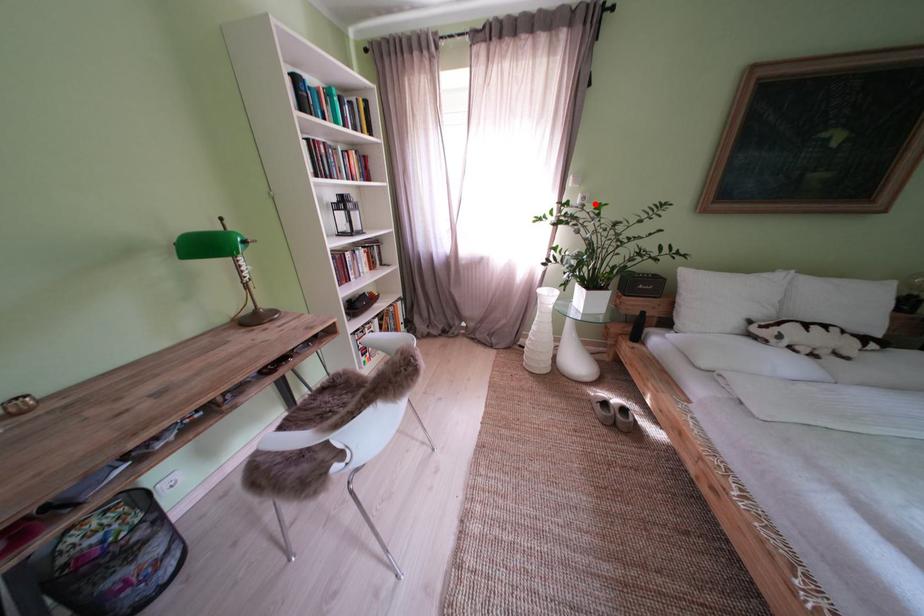
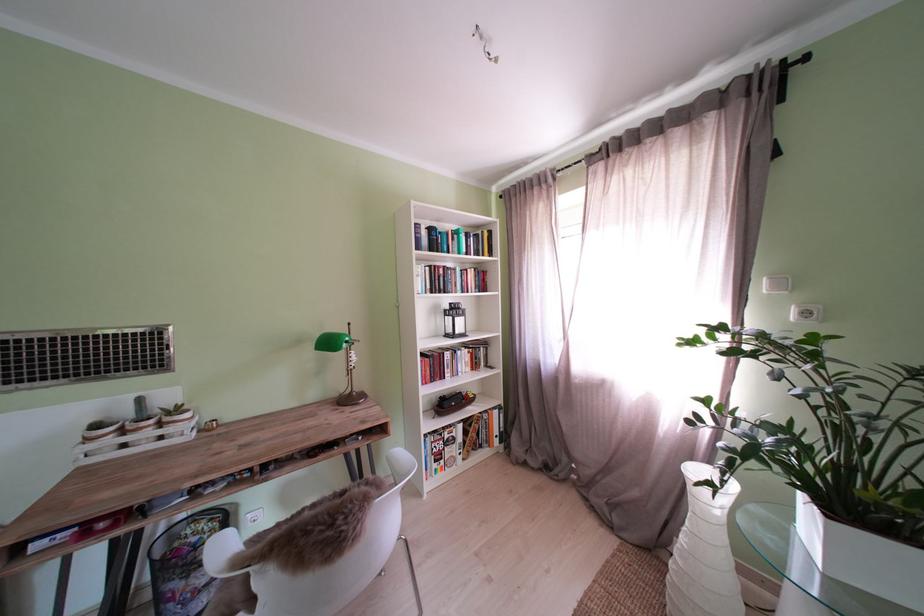
The point at the highlighted location is marked in the first image. Where is the corresponding point in the second image?

(818, 318)